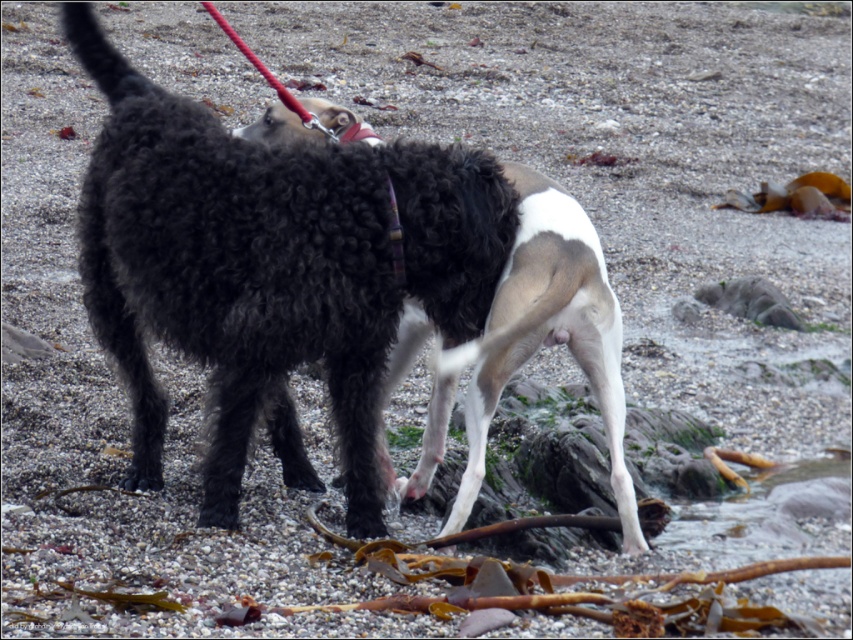
Measure the distance from curly black fur at center to plaid fabric neckband at center.

A distance of 33.61 inches exists between curly black fur at center and plaid fabric neckband at center.

Is point (618, 321) less distant than point (347, 132)?

Yes, it is in front of point (347, 132).

Does point (564, 289) come in front of point (341, 134)?

Yes.

Image resolution: width=853 pixels, height=640 pixels. Find the location of `curly black fur at center`. curly black fur at center is located at coordinates pos(532,344).